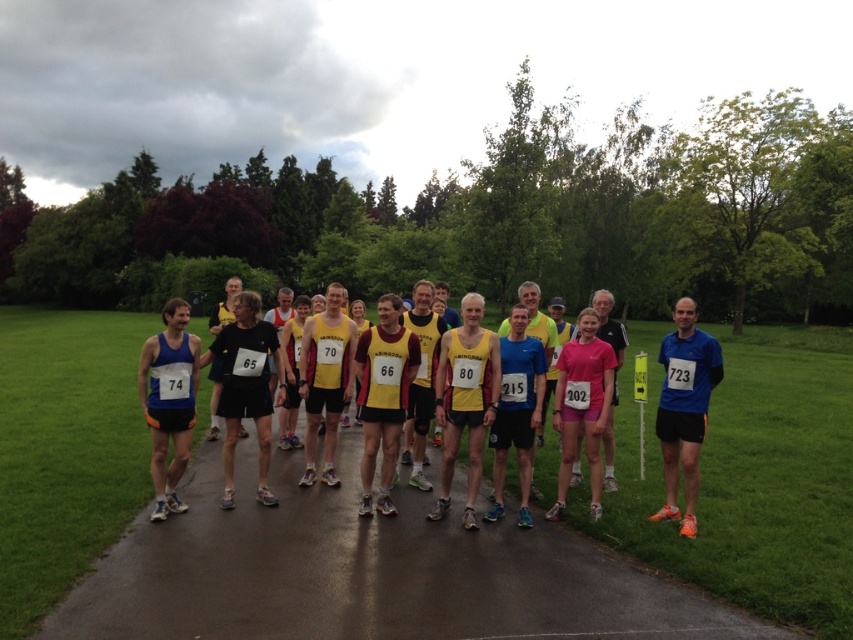
Between point (149, 604) and point (701, 348), which one is positioned behind?

The point (701, 348) is more distant.

Between black asphalt road at center and blue fabric running suit at right, which one has more height?

With more height is blue fabric running suit at right.

Locate an element on the screen. The width and height of the screenshot is (853, 640). black asphalt road at center is located at coordinates (370, 573).